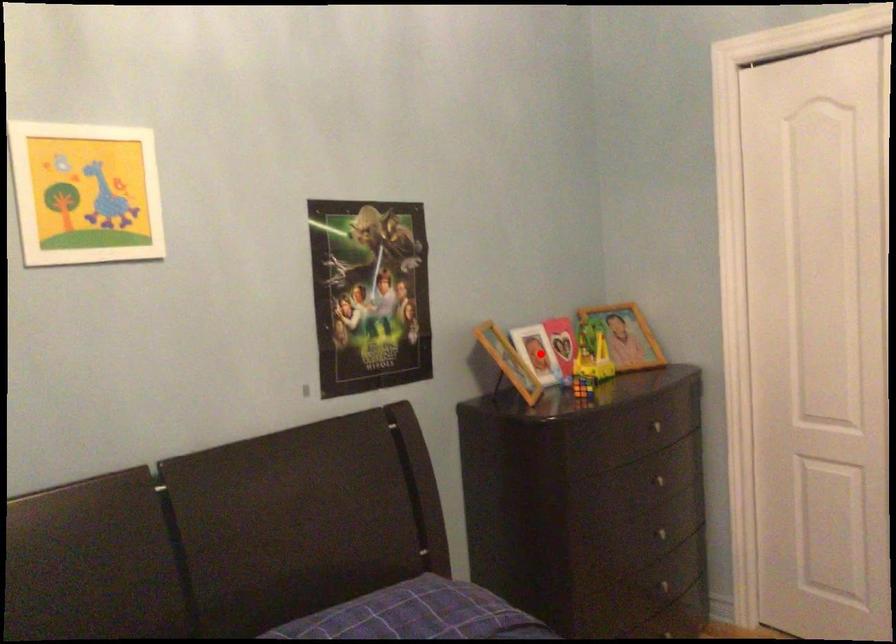
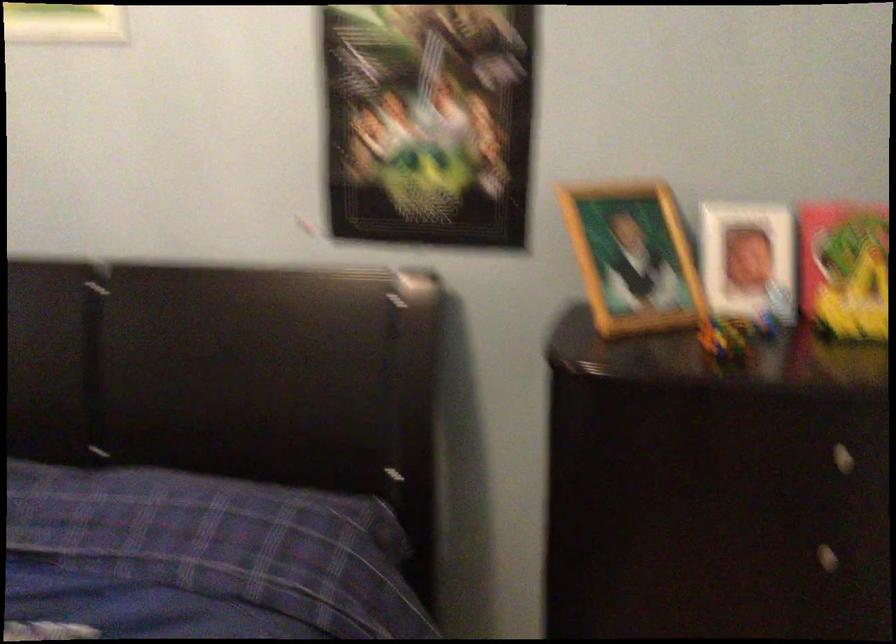
Question: I am providing you with two images of the same scene from different viewpoints. A red point is marked on the first image. At the location where the point appears in image 1, is it still visible in image 2?

Choices:
 (A) Yes
 (B) No

Answer: (A)